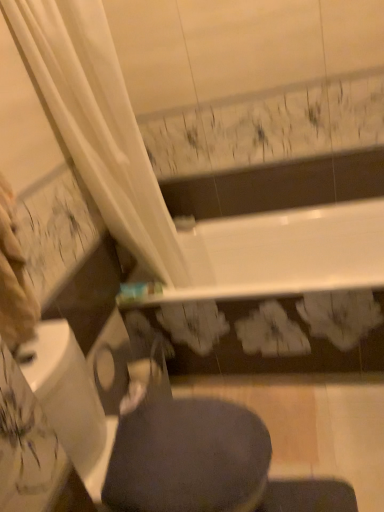
What do you see at coordinates (188, 458) in the screenshot? I see `dark gray fabric at lower center` at bounding box center [188, 458].

Locate an element on the screen. This screenshot has width=384, height=512. dark gray fabric at lower center is located at coordinates pos(188,458).

What do you see at coordinates (147, 438) in the screenshot? The width and height of the screenshot is (384, 512). I see `dark gray fabric swivel chair at lower center` at bounding box center [147, 438].

Find the location of a particular element. The height and width of the screenshot is (512, 384). dark gray fabric swivel chair at lower center is located at coordinates (147, 438).

Locate an element on the screen. dark gray fabric at lower center is located at coordinates (188, 458).

Is dark gray fabric at lower center at the right side of dark gray fabric swivel chair at lower center?

Indeed, dark gray fabric at lower center is positioned on the right side of dark gray fabric swivel chair at lower center.

Which object is more forward, dark gray fabric at lower center or dark gray fabric swivel chair at lower center?

dark gray fabric swivel chair at lower center is closer to the camera.

Considering the points (224, 439) and (152, 404), which point is in front, point (224, 439) or point (152, 404)?

The point (224, 439) is closer.

From the image's perspective, who appears lower, dark gray fabric at lower center or dark gray fabric swivel chair at lower center?

From the image's view, dark gray fabric swivel chair at lower center is below.

From a real-world perspective, between dark gray fabric at lower center and dark gray fabric swivel chair at lower center, who is vertically higher?

In real-world perspective, dark gray fabric at lower center is above.

Considering the sizes of dark gray fabric at lower center and dark gray fabric swivel chair at lower center in the image, is dark gray fabric at lower center wider or thinner than dark gray fabric swivel chair at lower center?

In the image, dark gray fabric at lower center appears to be more narrow than dark gray fabric swivel chair at lower center.

Between dark gray fabric at lower center and dark gray fabric swivel chair at lower center, which one has less height?

dark gray fabric at lower center is shorter.

Is dark gray fabric at lower center bigger than dark gray fabric swivel chair at lower center?

No.

Can dark gray fabric swivel chair at lower center be found inside dark gray fabric at lower center?

No, dark gray fabric swivel chair at lower center is not inside dark gray fabric at lower center.

Is dark gray fabric at lower center touching dark gray fabric swivel chair at lower center?

Yes, dark gray fabric at lower center is right next to dark gray fabric swivel chair at lower center and making contact.

Consider the image. Is dark gray fabric at lower center positioned with its back to dark gray fabric swivel chair at lower center?

Correct, dark gray fabric at lower center is looking away from dark gray fabric swivel chair at lower center.

The height and width of the screenshot is (512, 384). What are the coordinates of `swivel chair that is under the dark gray fabric at lower center (from a real-world perspective)` in the screenshot? It's located at (147, 438).

Which object is positioned more to the left, dark gray fabric swivel chair at lower center or dark gray fabric at lower center?

dark gray fabric swivel chair at lower center is more to the left.

Which object is closer to the camera taking this photo, dark gray fabric swivel chair at lower center or dark gray fabric at lower center?

dark gray fabric swivel chair at lower center is in front.

Consider the image. Which point is more distant from viewer, (227,481) or (248,470)?

The point (248,470) is farther from the camera.

From the image's perspective, is dark gray fabric swivel chair at lower center located above dark gray fabric at lower center?

→ Actually, dark gray fabric swivel chair at lower center appears below dark gray fabric at lower center in the image.

From a real-world perspective, relative to dark gray fabric at lower center, is dark gray fabric swivel chair at lower center vertically above or below?

Clearly, from a real-world perspective, dark gray fabric swivel chair at lower center is below dark gray fabric at lower center.

Which of these two, dark gray fabric swivel chair at lower center or dark gray fabric at lower center, is thinner?

dark gray fabric at lower center.

Can you confirm if dark gray fabric swivel chair at lower center is taller than dark gray fabric at lower center?

Correct, dark gray fabric swivel chair at lower center is much taller as dark gray fabric at lower center.

Considering the sizes of objects dark gray fabric swivel chair at lower center and dark gray fabric at lower center in the image provided, who is smaller, dark gray fabric swivel chair at lower center or dark gray fabric at lower center?

dark gray fabric at lower center.

Is dark gray fabric swivel chair at lower center inside or outside of dark gray fabric at lower center?

dark gray fabric swivel chair at lower center is located beyond the bounds of dark gray fabric at lower center.

Would you consider dark gray fabric swivel chair at lower center to be distant from dark gray fabric at lower center?

dark gray fabric swivel chair at lower center is actually quite close to dark gray fabric at lower center.

Is dark gray fabric swivel chair at lower center turned away from dark gray fabric at lower center?

Yes, dark gray fabric swivel chair at lower center is positioned with its back facing dark gray fabric at lower center.

This screenshot has height=512, width=384. Identify the location of swivel chair below the dark gray fabric at lower center (from a real-world perspective). (147, 438).

Identify the location of swivel chair lying on the left of dark gray fabric at lower center. (147, 438).

The width and height of the screenshot is (384, 512). Identify the location of bidet above the dark gray fabric swivel chair at lower center (from a real-world perspective). (188, 458).